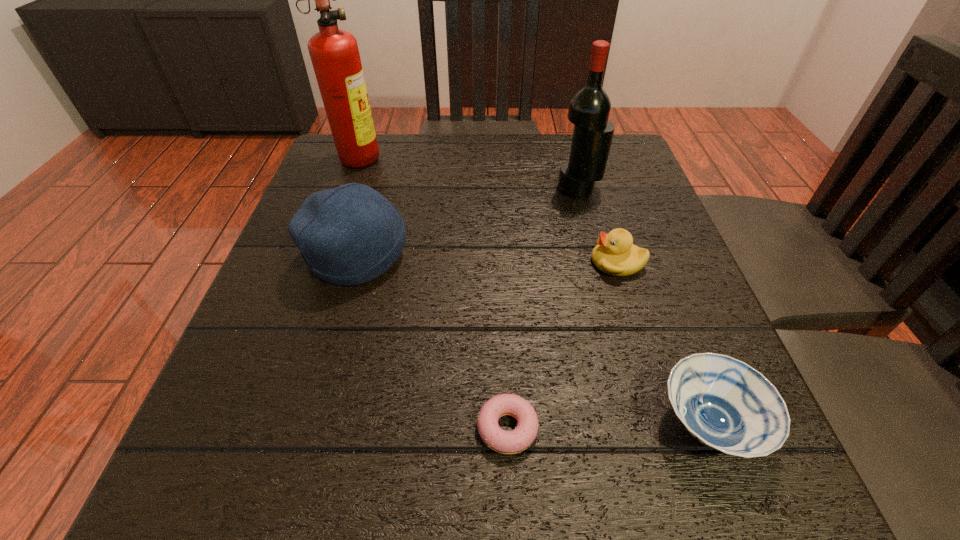
Where is `vacant space located on the back of the fifth nearest object`? This screenshot has height=540, width=960. vacant space located on the back of the fifth nearest object is located at coordinates (569, 153).

Where is `free space located 0.310m on the back of the fourth shortest object`? free space located 0.310m on the back of the fourth shortest object is located at coordinates (389, 146).

The height and width of the screenshot is (540, 960). Find the location of `vacant space located at the face of the duckling`. vacant space located at the face of the duckling is located at coordinates (554, 262).

Where is `free space located 0.320m at the face of the duckling`? free space located 0.320m at the face of the duckling is located at coordinates (421, 262).

You are a GUI agent. You are given a task and a screenshot of the screen. Output one action in this format:
    pyautogui.click(x=<x>, y=<y>)
    Task: Click on the free space located at the face of the duckling
    The width and height of the screenshot is (960, 540).
    Given the screenshot: What is the action you would take?
    pyautogui.click(x=421, y=262)

The image size is (960, 540). Identify the location of free space located on the left of the soup bowl. (453, 424).

You are a GUI agent. You are given a task and a screenshot of the screen. Output one action in this format:
    pyautogui.click(x=<x>, y=<y>)
    Task: Click on the free space located 0.250m on the left of the doughnut
    The height and width of the screenshot is (540, 960).
    Given the screenshot: What is the action you would take?
    pyautogui.click(x=295, y=428)

This screenshot has width=960, height=540. In order to click on fire extinguisher at the far edge in this screenshot , I will do `click(334, 53)`.

The height and width of the screenshot is (540, 960). Find the location of `wine bottle present at the far edge`. wine bottle present at the far edge is located at coordinates (589, 108).

Where is `soup bowl that is positioned at the near edge`? The image size is (960, 540). soup bowl that is positioned at the near edge is located at coordinates (724, 403).